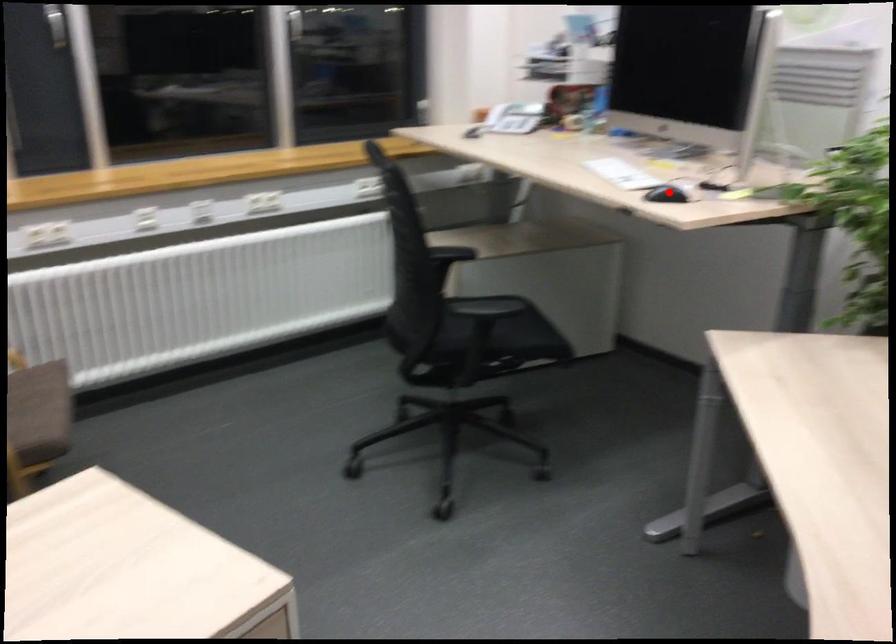
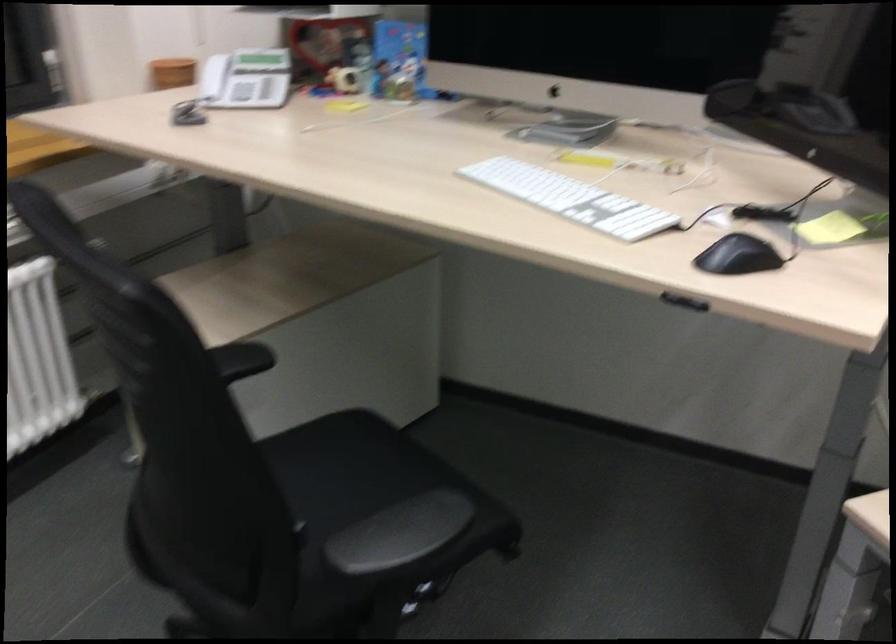
Locate, in the second image, the point that corresponds to the highlighted location in the first image.

(737, 256)